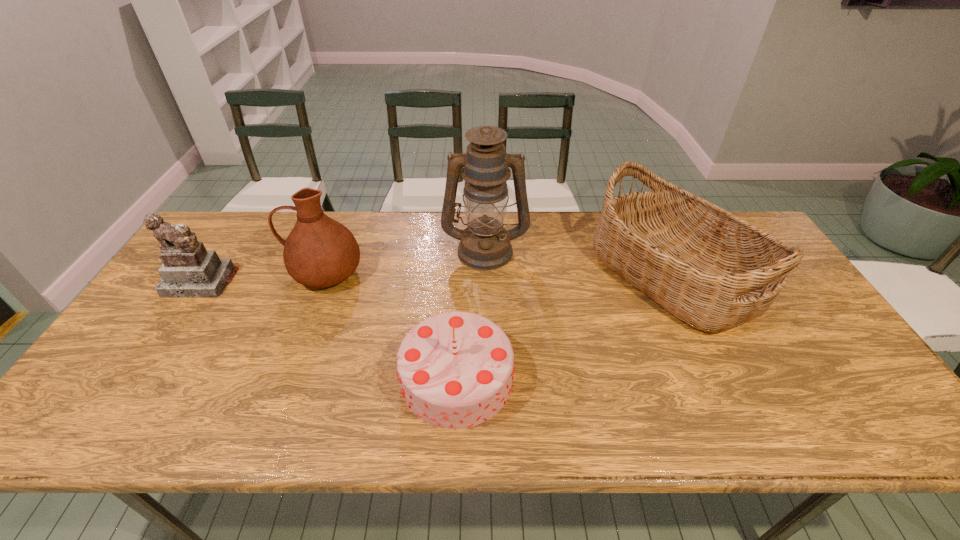
Locate an element on the screen. free space between the fourth object from right to left and the shortest object is located at coordinates (391, 325).

Locate which object is the second closest to the rightmost object. Please provide its 2D coordinates. Your answer should be formatted as a tuple, i.e. [(x, y)], where the tuple contains the x and y coordinates of a point satisfying the conditions above.

[(455, 369)]

Identify which object is located as the second nearest to the rightmost object. Please provide its 2D coordinates. Your answer should be formatted as a tuple, i.e. [(x, y)], where the tuple contains the x and y coordinates of a point satisfying the conditions above.

[(455, 369)]

Identify the location of vacant region that satisfies the following two spatial constraints: 1. on the side of the pitcher with the handle; 2. on the front-facing side of the figurine. (323, 282).

You are a GUI agent. You are given a task and a screenshot of the screen. Output one action in this format:
    pyautogui.click(x=<x>, y=<y>)
    Task: Click on the free space in the image that satisfies the following two spatial constraints: 1. on the back side of the basket; 2. on the right side of the shortest object
    Image resolution: width=960 pixels, height=540 pixels.
    Given the screenshot: What is the action you would take?
    pyautogui.click(x=462, y=275)

I want to click on vacant space that satisfies the following two spatial constraints: 1. on the side of the fourth object from right to left with the handle; 2. on the front-facing side of the figurine, so click(x=323, y=282).

Image resolution: width=960 pixels, height=540 pixels. Identify the location of vacant area that satisfies the following two spatial constraints: 1. on the side of the fourth object from right to left with the handle; 2. on the front-facing side of the leftmost object. pyautogui.click(x=323, y=282).

Identify the location of vacant position in the image that satisfies the following two spatial constraints: 1. on the side of the second object from left to right with the handle; 2. on the front-facing side of the leftmost object. This screenshot has width=960, height=540. (323, 282).

Where is `vacant space that satisfies the following two spatial constraints: 1. on the side of the fourth object from right to left with the handle; 2. on the back side of the basket`? The height and width of the screenshot is (540, 960). vacant space that satisfies the following two spatial constraints: 1. on the side of the fourth object from right to left with the handle; 2. on the back side of the basket is located at coordinates (325, 275).